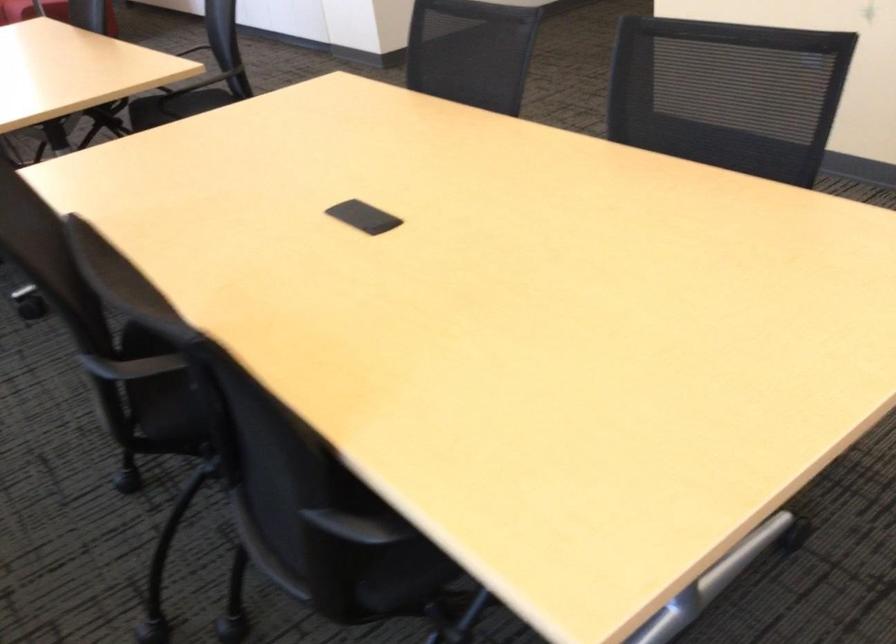
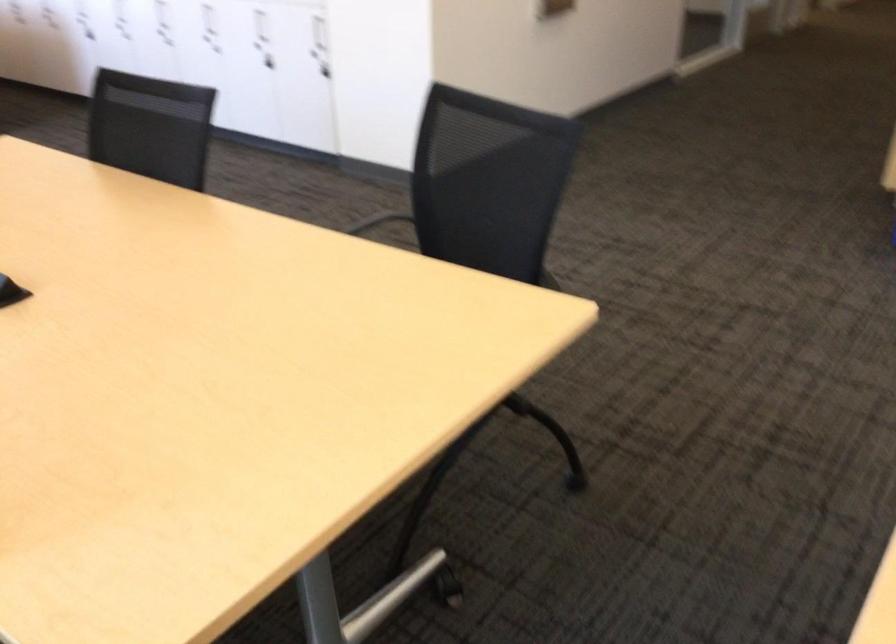
Consider the image. The images are taken continuously from a first-person perspective. In which direction are you moving?

The movement direction of the cameraman is left, forward.